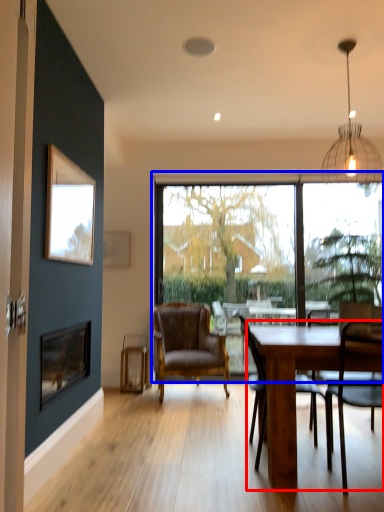
Question: Which point is closer to the camera, round table (highlighted by a red box) or window (highlighted by a blue box)?

Choices:
 (A) round table
 (B) window

Answer: (A)